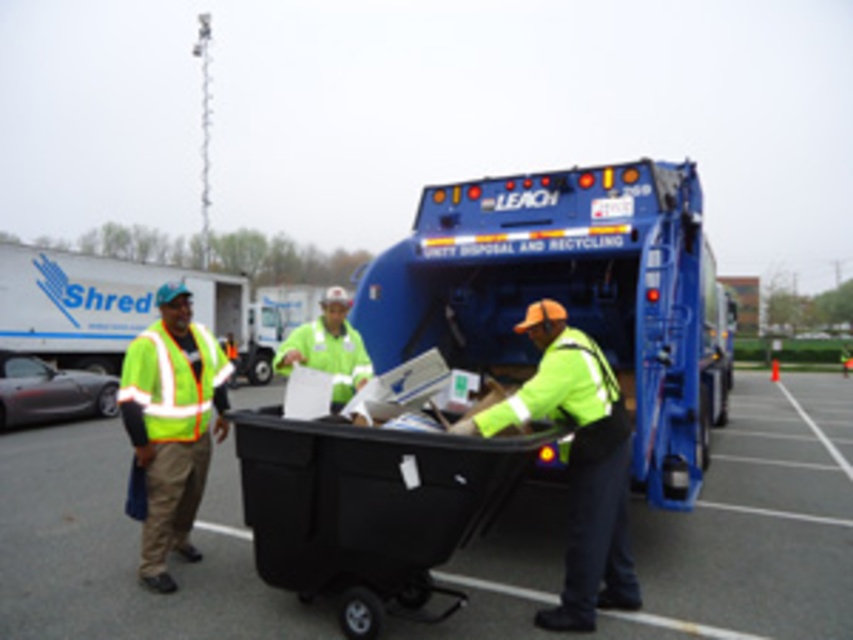
You are standing at the origin point of the coordinate system in the parking lot. The blue metallic garbage truck at center is located at coordinates 0.463, 0.668. If you want to move towards the truck, which direction should you head? Please provide your answer in terms of cardinal directions like North, South, East, or West.

The blue metallic garbage truck at center is located at coordinates (569, 296). Since the coordinate system is not specified, it is impossible to determine the exact direction without additional information about the axes orientation.